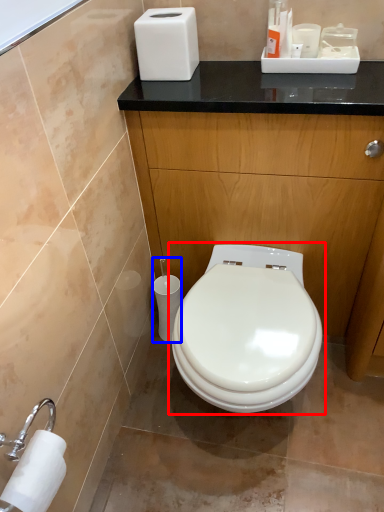
Question: Which object appears closest to the camera in this image, toilet (highlighted by a red box) or toilet paper (highlighted by a blue box)?

Choices:
 (A) toilet
 (B) toilet paper

Answer: (A)